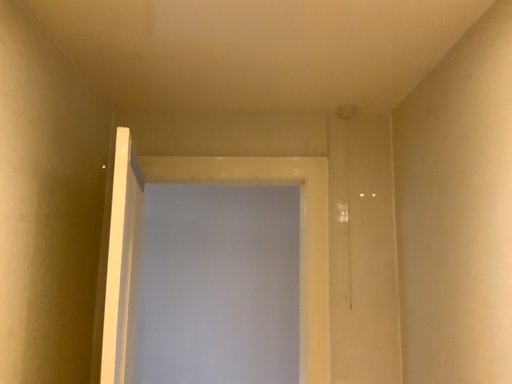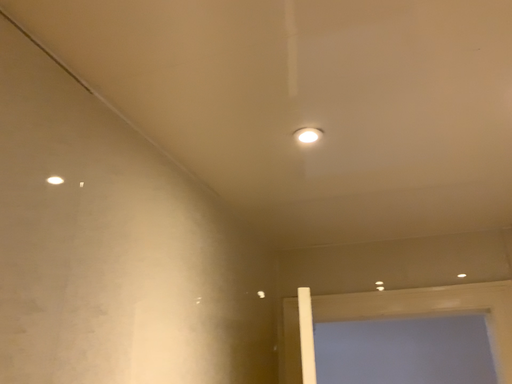
Question: Which way did the camera rotate in the video?

Choices:
 (A) rotated downward
 (B) rotated upward

Answer: (B)